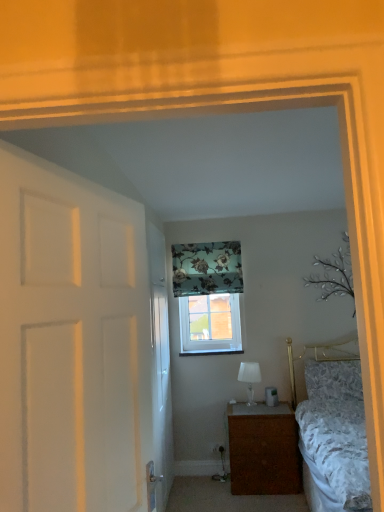
The height and width of the screenshot is (512, 384). What are the coordinates of `vacant region under white glossy table lamp at center (from a real-world perspective)` in the screenshot? It's located at (244, 400).